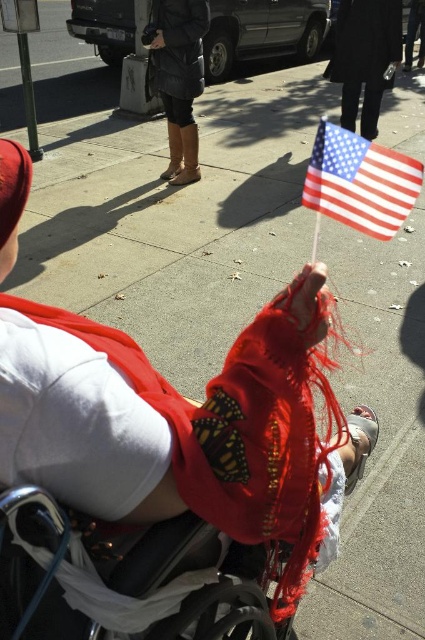
Question: From the image, what is the correct spatial relationship of black plastic wheelchair at center in relation to leather boots at center?

Choices:
 (A) left
 (B) right

Answer: (B)

Question: Can you confirm if black plastic wheelchair at center is positioned to the left of leather boots at center?

Choices:
 (A) no
 (B) yes

Answer: (A)

Question: Which point is farther to the camera?

Choices:
 (A) black plastic wheelchair at center
 (B) leather boots at center
 (C) american flag at upper right

Answer: (B)

Question: Which point is farther to the camera?

Choices:
 (A) (87, 538)
 (B) (184, 109)

Answer: (B)

Question: Which of the following is the farthest from the observer?

Choices:
 (A) (187, 604)
 (B) (178, 1)
 (C) (314, 173)

Answer: (B)

Question: Can you confirm if american flag at upper right is thinner than leather boots at center?

Choices:
 (A) yes
 (B) no

Answer: (A)